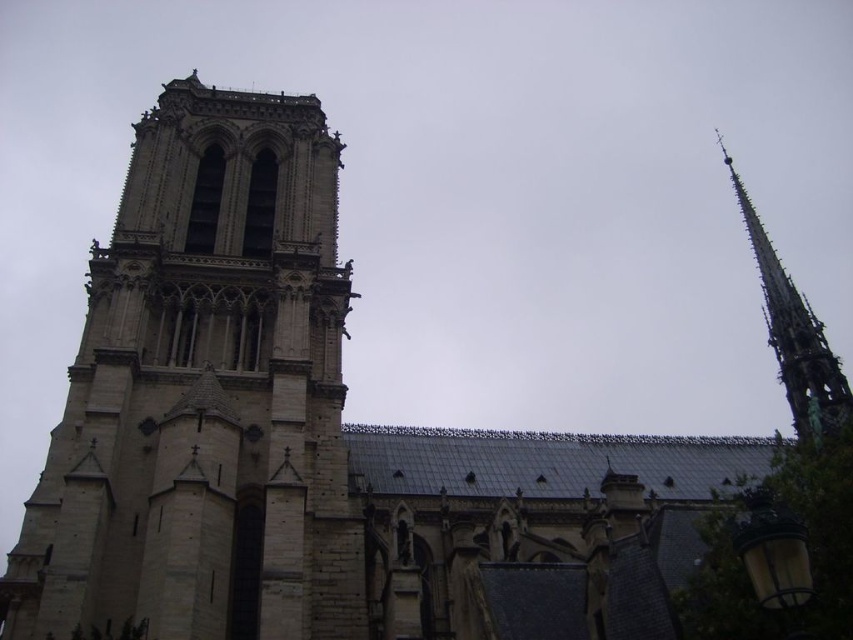
You are a tourist standing at the base of the cathedral. You notice the stone tower at left and the green copper spire at upper right. Which structure do you think reaches higher into the sky?

The stone tower at left is much taller than the green copper spire at upper right, so the stone tower at left reaches higher into the sky.

You are an architect examining the cathedral facade. You notice the stone tower at left and the green copper spire at upper right. Which of these two structures has a greater width?

The stone tower at left has a greater width than the green copper spire at upper right.